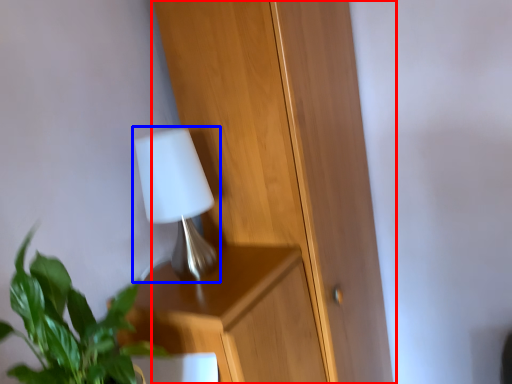
Question: Which of the following is the farthest to the observer, dresser (highlighted by a red box) or lamp (highlighted by a blue box)?

Choices:
 (A) dresser
 (B) lamp

Answer: (A)